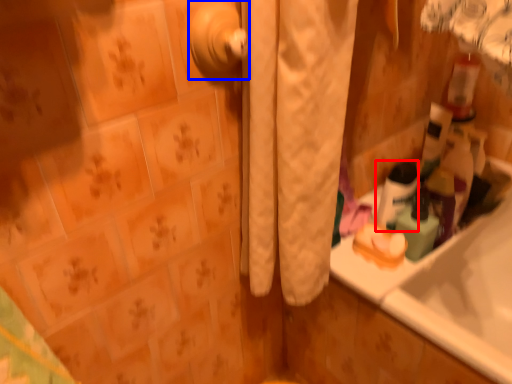
Question: Among these objects, which one is nearest to the camera, mouthwash (highlighted by a red box) or door handle (highlighted by a blue box)?

Choices:
 (A) mouthwash
 (B) door handle

Answer: (B)